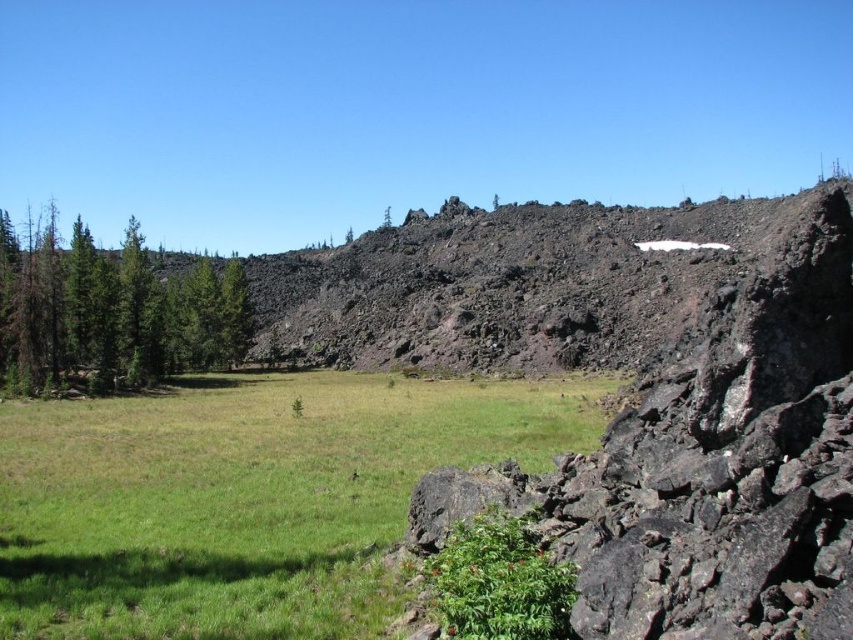
Question: Is green grassy field at center above green matte trees at left?

Choices:
 (A) yes
 (B) no

Answer: (B)

Question: Does green grassy field at center appear under green matte trees at left?

Choices:
 (A) no
 (B) yes

Answer: (B)

Question: From the image, what is the correct spatial relationship of green grassy field at center in relation to green matte trees at left?

Choices:
 (A) below
 (B) above

Answer: (A)